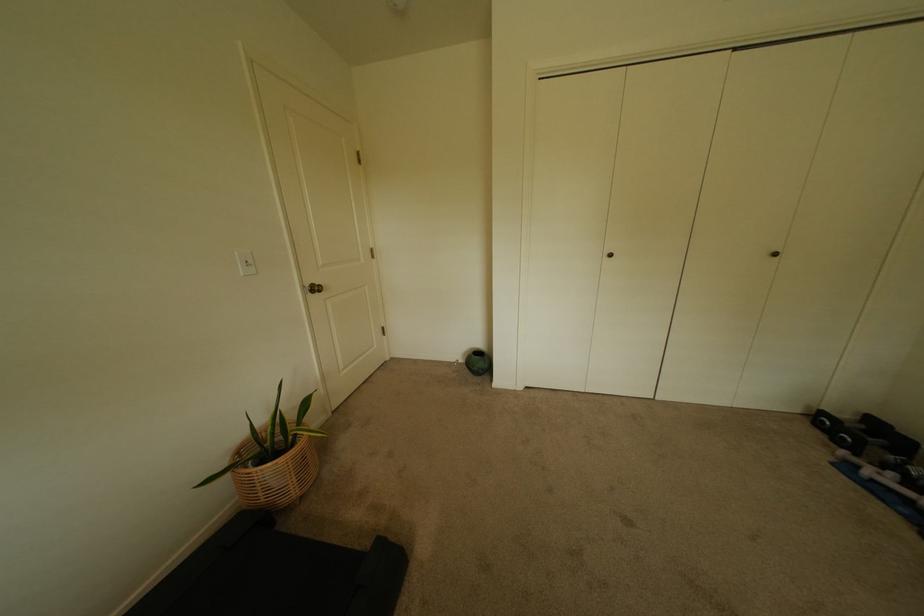
What do you see at coordinates (298, 585) in the screenshot? This screenshot has height=616, width=924. I see `the treadmill handle` at bounding box center [298, 585].